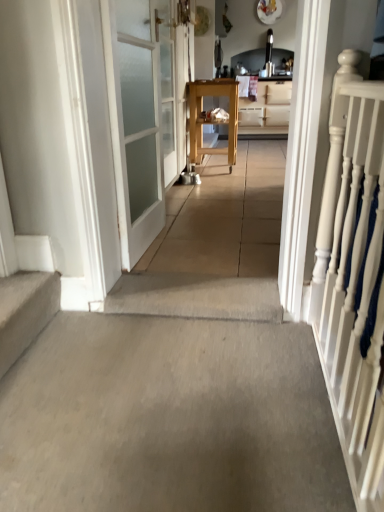
Question: Should I look upward or downward to see wooden cart at center?

Choices:
 (A) down
 (B) up

Answer: (B)

Question: From the image's perspective, is clear glass door at center, marked as the 2th door in a front-to-back arrangement, beneath gray concrete at center?

Choices:
 (A) yes
 (B) no

Answer: (B)

Question: Is clear glass door at center, the 1th door from the back, closer to the viewer compared to gray concrete at center?

Choices:
 (A) yes
 (B) no

Answer: (B)

Question: Is clear glass door at center, marked as the 2th door in a front-to-back arrangement, not close to gray concrete at center?

Choices:
 (A) yes
 (B) no

Answer: (A)

Question: Can you confirm if clear glass door at center, the 1th door from the back, is shorter than gray concrete at center?

Choices:
 (A) yes
 (B) no

Answer: (B)

Question: Does clear glass door at center, the 1th door from the back, appear on the left side of gray concrete at center?

Choices:
 (A) no
 (B) yes

Answer: (B)

Question: Does clear glass door at center, the 1th door from the back, turn towards gray concrete at center?

Choices:
 (A) no
 (B) yes

Answer: (A)

Question: Is white frosted glass door at left, arranged as the 1th door when viewed from the front, bigger than wooden cart at center?

Choices:
 (A) no
 (B) yes

Answer: (A)

Question: Is white frosted glass door at left, which ranks as the 2th door in back-to-front order, thinner than wooden cart at center?

Choices:
 (A) yes
 (B) no

Answer: (A)

Question: Can you confirm if white frosted glass door at left, which ranks as the 2th door in back-to-front order, is smaller than wooden cart at center?

Choices:
 (A) yes
 (B) no

Answer: (A)

Question: Are white frosted glass door at left, arranged as the 1th door when viewed from the front, and wooden cart at center far apart?

Choices:
 (A) yes
 (B) no

Answer: (A)

Question: Can you confirm if white frosted glass door at left, which ranks as the 2th door in back-to-front order, is wider than wooden cart at center?

Choices:
 (A) no
 (B) yes

Answer: (A)

Question: Is white frosted glass door at left, which ranks as the 2th door in back-to-front order, positioned before wooden cart at center?

Choices:
 (A) yes
 (B) no

Answer: (A)

Question: Is white painted wood railing at right to the right of carpeted stairs at lower left from the viewer's perspective?

Choices:
 (A) no
 (B) yes

Answer: (B)